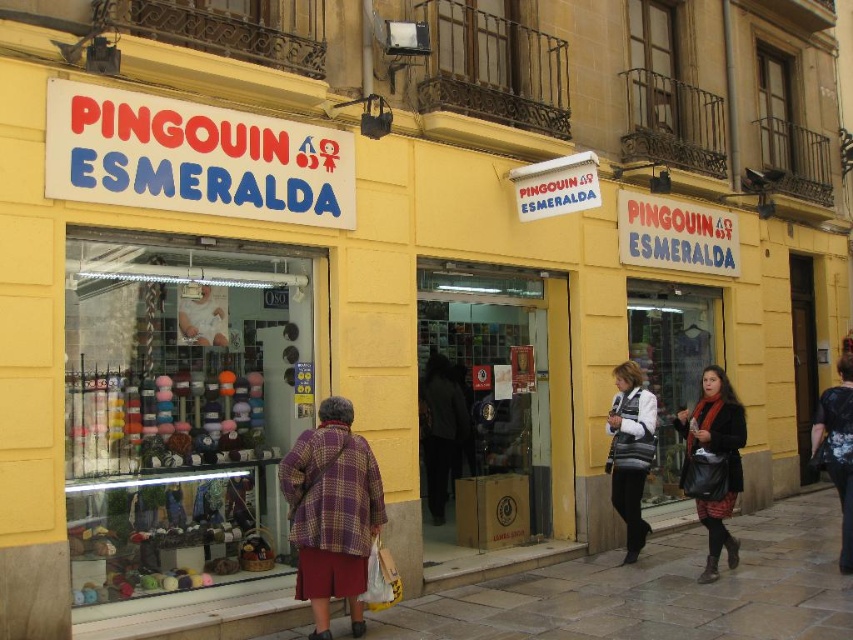
You are a customer standing outside the store. You want to enter the store through the clear glass door at center. However, you are carrying a large plaid wool coat at center. Can you fit through the door without folding the coat?

The clear glass door at center is larger in size than the plaid wool coat at center, so you can fit through the door without folding the coat.

You are a customer looking at the shop window. You see the multicolored yarns at left and the transparent glass shop window at center. Which object is bigger in size?

The multicolored yarns at left are larger in size compared to the transparent glass shop window at center according to the description.

You are standing in front of the shop named Pingouin Esmeralda. The shop has a clear glass door at center. If you want to enter the shop, where should you walk towards? Please answer with coordinates in the format of x,y between 0 and 1, with 0,0 being the bottom left corner and 1,1 being the top right corner.

The clear glass door at center is located at coordinates (498, 403) so you should walk towards that point.